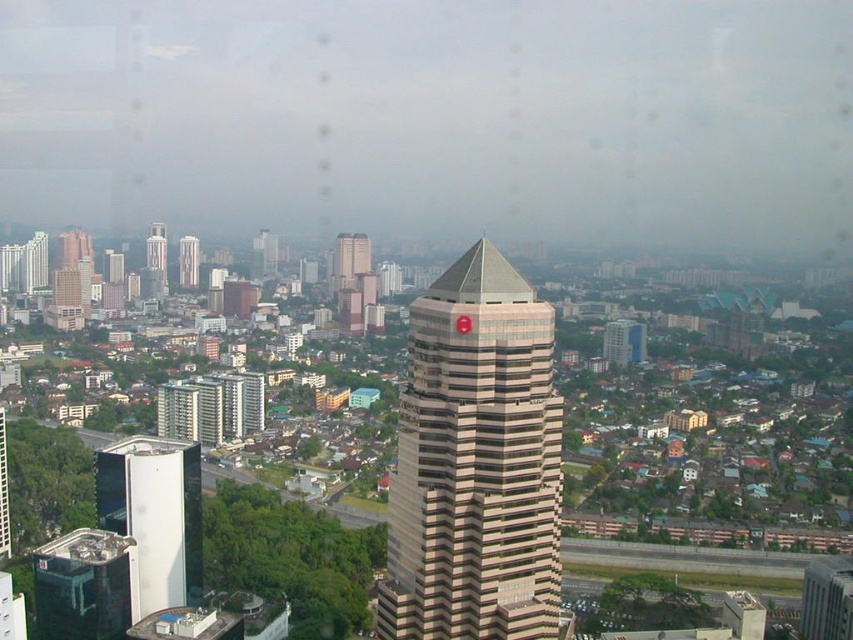
You are a drone operator tasked with flying a drone between the beige striped tower at center and the white glass tower at lower left. The drone has a maximum flight distance of 30 meters. Can the drone safely complete this task without exceeding its range?

The beige striped tower at center and the white glass tower at lower left are 33.28 meters apart from each other. Since the drone has a maximum flight distance of 30 meters, it cannot safely complete the task without exceeding its range.

You are an urban planner reviewing this city layout. You need to determine the relative positions of the white glass tower at lower left and the light beige concrete building at center. Which one is positioned to the left when viewed from above?

The white glass tower at lower left is to the right of the light beige concrete building at center, so the light beige concrete building at center is positioned to the left.